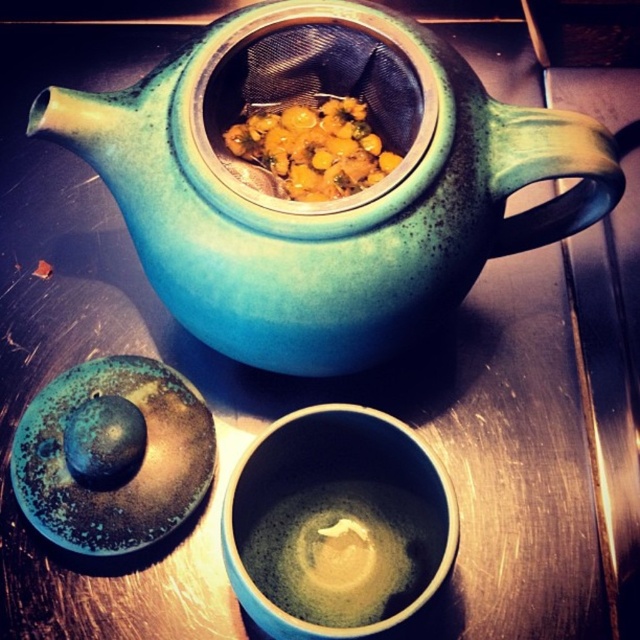
Question: Among these points, which one is farthest from the camera?

Choices:
 (A) (314, 100)
 (B) (396, 330)
 (C) (346, 525)

Answer: (A)

Question: In this image, where is teal ceramic teapot at center located relative to yellow-orange textured seeds at center?

Choices:
 (A) right
 (B) left

Answer: (A)

Question: Which object is positioned closest to the teal ceramic teapot at center?

Choices:
 (A) smooth matte black tea at center
 (B) yellow-orange textured seeds at center

Answer: (B)

Question: Can you confirm if smooth matte black tea at center is wider than yellow-orange textured seeds at center?

Choices:
 (A) yes
 (B) no

Answer: (A)

Question: Does smooth matte black tea at center appear under yellow-orange textured seeds at center?

Choices:
 (A) yes
 (B) no

Answer: (A)

Question: Estimate the real-world distances between objects in this image. Which object is farther from the teal ceramic teapot at center?

Choices:
 (A) yellow-orange textured seeds at center
 (B) smooth matte black tea at center

Answer: (B)